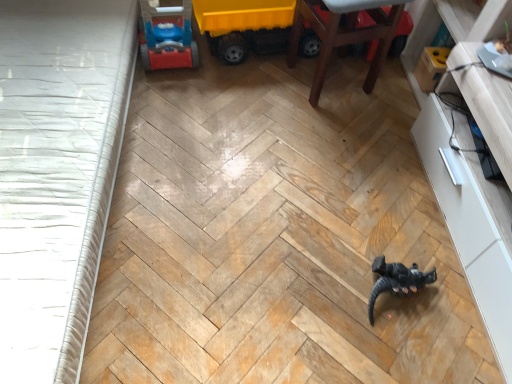
You are a GUI agent. You are given a task and a screenshot of the screen. Output one action in this format:
    pyautogui.click(x=<x>, y=<y>)
    Task: Click on the vacant area that is in front of black matte dinosaur at center, the first toy positioned from the bottom
    This screenshot has height=384, width=512.
    Given the screenshot: What is the action you would take?
    pyautogui.click(x=403, y=349)